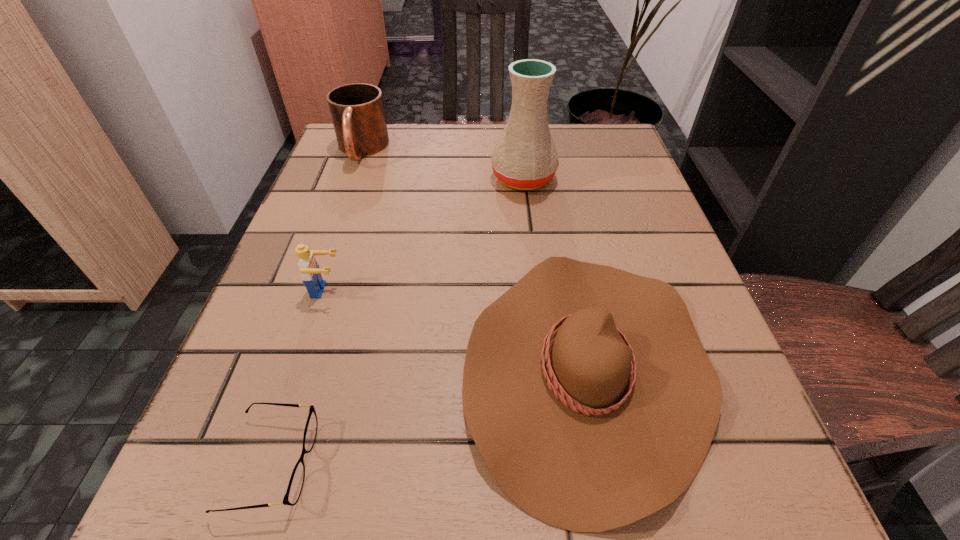
Locate an element on the screen. Image resolution: width=960 pixels, height=540 pixels. the tallest object is located at coordinates (525, 157).

Find the location of a particular element. the fourth shortest object is located at coordinates (357, 111).

Identify the location of Lego. This screenshot has width=960, height=540. (310, 271).

This screenshot has height=540, width=960. Find the location of `cowboy hat`. cowboy hat is located at coordinates pos(586,389).

The width and height of the screenshot is (960, 540). What are the coordinates of `the shortest object` in the screenshot? It's located at (296, 482).

Where is `vacant space located 0.120m on the front of the pottery`? The image size is (960, 540). vacant space located 0.120m on the front of the pottery is located at coordinates (531, 236).

Identify the location of vacant space located on the side of the second tallest object with the handle. (315, 281).

Find the location of a particular element. The height and width of the screenshot is (540, 960). vacant space located on the face of the Lego is located at coordinates (501, 290).

Find the location of a particular element. The height and width of the screenshot is (540, 960). free region located 0.250m on the back of the cowboy hat is located at coordinates (551, 182).

Where is `free space located 0.080m on the front-facing side of the spectacles`? free space located 0.080m on the front-facing side of the spectacles is located at coordinates (376, 463).